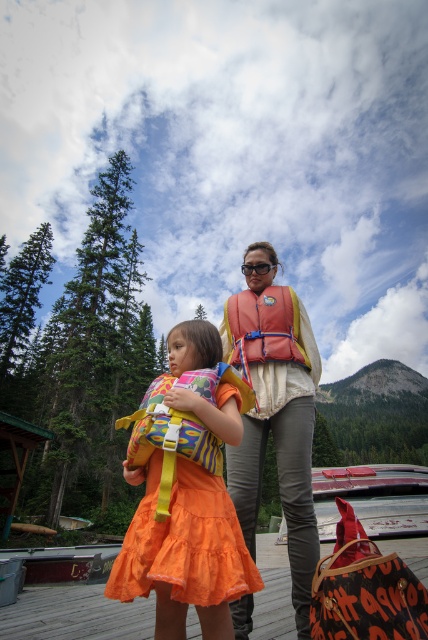
Between point (201, 470) and point (272, 317), which one is positioned behind?

Positioned behind is point (272, 317).

Which is below, orange fabric dress at center or orange fabric life jacket at center?

orange fabric dress at center

Between point (222, 604) and point (252, 356), which one is positioned in front?

Positioned in front is point (222, 604).

Identify the location of orange fabric dress at center. Image resolution: width=428 pixels, height=640 pixels. pyautogui.click(x=186, y=490).

Can you confirm if leather textured bag at lower right is thinner than orange fabric life jacket at center?

No, leather textured bag at lower right is not thinner than orange fabric life jacket at center.

This screenshot has height=640, width=428. I want to click on leather textured bag at lower right, so click(x=365, y=589).

Is point (279, 358) in front of point (240, 312)?

Yes, point (279, 358) is in front of point (240, 312).

Between orange life vest at center and orange fabric life jacket at center, which one appears on the left side from the viewer's perspective?

orange life vest at center is more to the left.

What do you see at coordinates (276, 417) in the screenshot? I see `orange life vest at center` at bounding box center [276, 417].

Locate an element on the screen. orange life vest at center is located at coordinates coord(276,417).